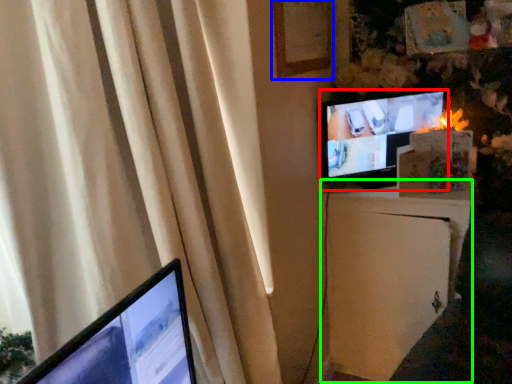
Question: Estimate the real-world distances between objects in this image. Which object is closer to television (highlighted by a red box), picture frame (highlighted by a blue box) or file cabinet (highlighted by a green box)?

Choices:
 (A) picture frame
 (B) file cabinet

Answer: (B)